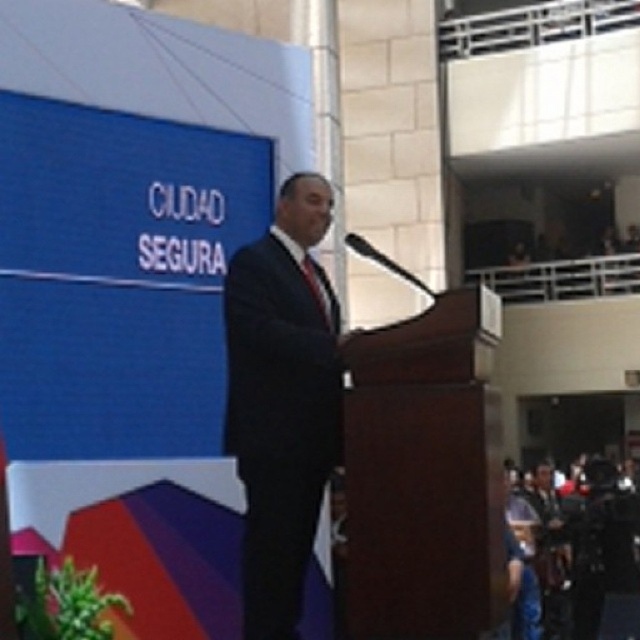
You are taking a photo of the podium and the banner. You want to focus on the point at the bottom of the podium first. Which point should you focus on first to ensure both points are in focus? The points are point at point [268,595] and point at point [324,301].

You should focus on point at point [268,595] first because it is closer to the camera than point at point [324,301]. Since it is closer, focusing there will ensure the depth of field includes both points.

Looking at this image, you are organizing a formal event and need to ensure that the attire of the speaker matches the theme. Given that the dark suit at center and the red silk tie at center are part of the speaker attire, which item would be more noticeable to the audience?

The red silk tie at center is larger than the dark suit at center, making it more noticeable to the audience.

You are organizing a costume party and need to ensure all outfits are proportional. You have a dark suit at center and a red silk tie at center. According to the image, which item has a greater width?

The red silk tie at center has a greater width than the dark suit at center, as the dark suit at center is narrower.